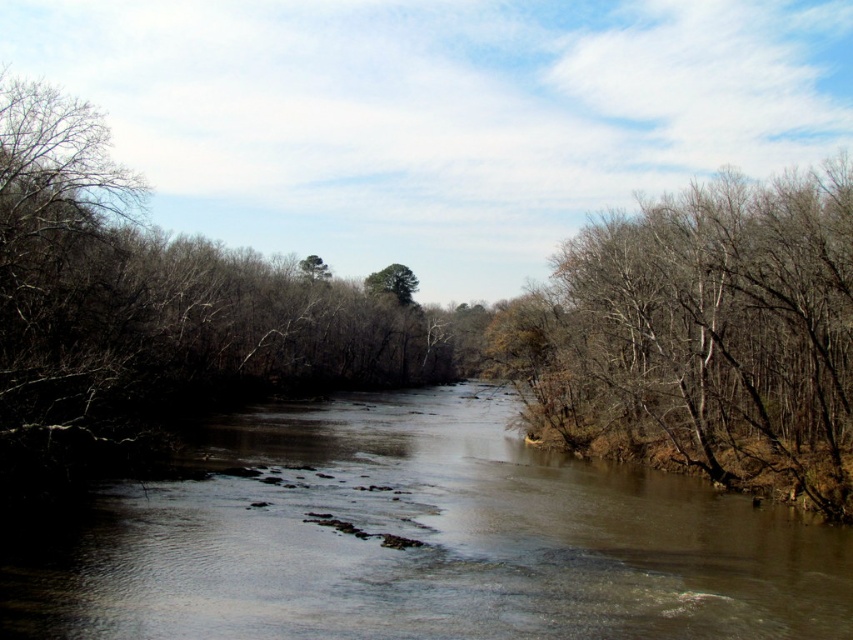
Does point (753, 529) come closer to viewer compared to point (404, 298)?

Yes, it is in front of point (404, 298).

Which is behind, point (437, 538) or point (407, 300)?

Positioned behind is point (407, 300).

At what (x,y) coordinates should I click in order to perform the action: click on brown muddy water at center. Please return your answer as a coordinate pair (x, y). This screenshot has width=853, height=640. Looking at the image, I should click on (422, 541).

Is brown leafless tree at right taller than green leafy tree at center?

Yes.

Does brown leafless tree at right have a larger size compared to green leafy tree at center?

Yes, brown leafless tree at right is bigger than green leafy tree at center.

Who is more forward, (601, 236) or (397, 300)?

Positioned in front is point (601, 236).

Identify the location of brown leafless tree at right. (701, 337).

I want to click on brown muddy water at center, so click(x=422, y=541).

Is point (465, 608) positioned in front of point (804, 268)?

Yes.

Locate an element on the screen. brown muddy water at center is located at coordinates (422, 541).